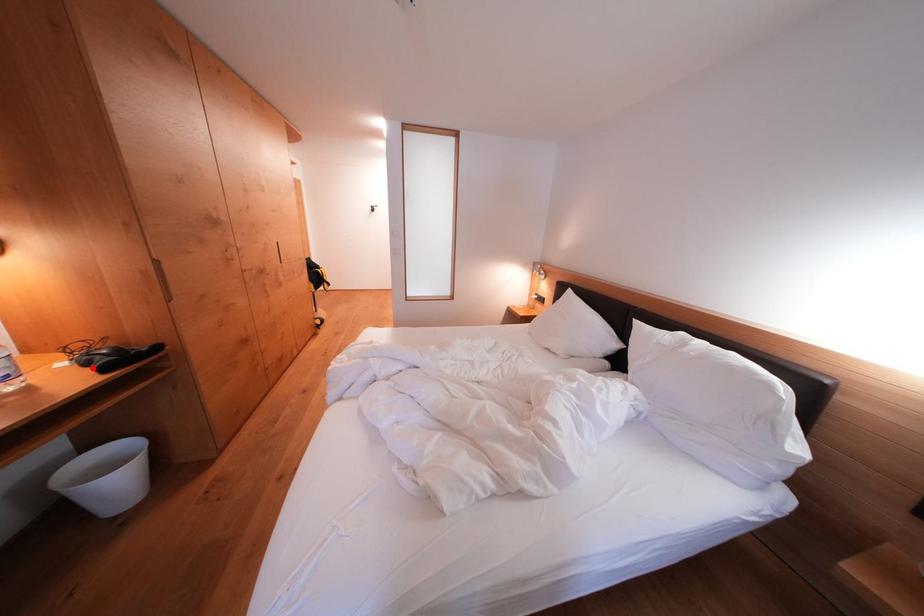
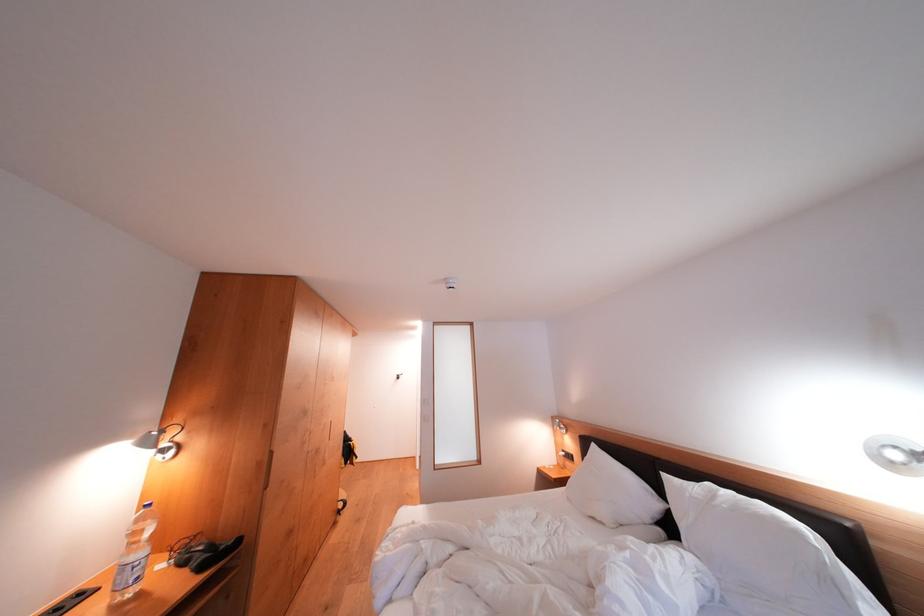
Find the pixel in the second image that matches the highlighted location in the first image.

(190, 567)